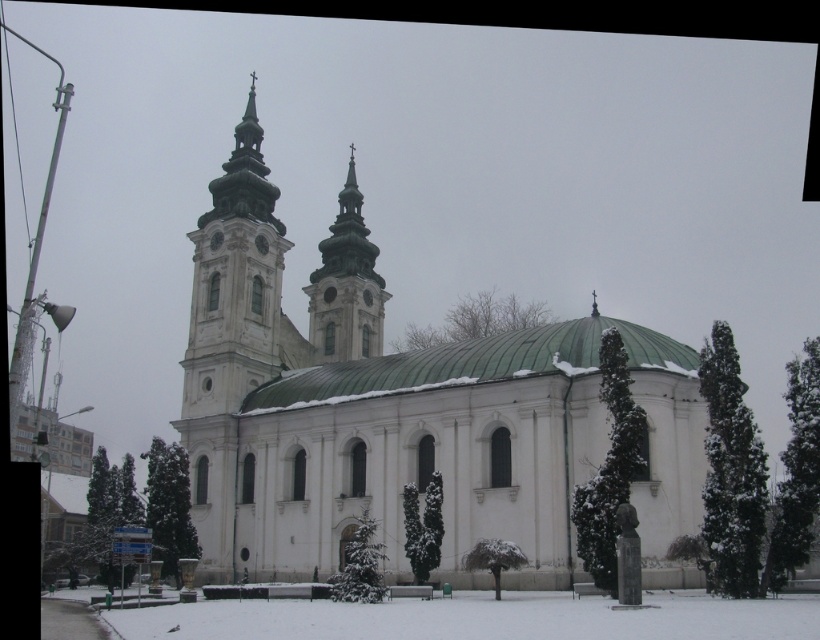
You are a photographer planning to capture the white stone church at center and the white stone tower at upper left in a single shot. Based on their sizes, which one should you focus on to ensure both are clearly visible in the frame?

The white stone church at center is bigger than the white stone tower at upper left, so you should focus on the white stone church at center to ensure both are clearly visible in the frame.

You are standing in front of the white stone church at center and want to take a photo of the smooth white steeple at center. Since the steeple is shorter than the church, will you need to adjust your camera angle upwards or downwards to frame it properly?

The white stone church at center has a greater height compared to the smooth white steeple at center. Therefore, you will need to adjust your camera angle downwards to frame the smooth white steeple at center properly since it is shorter than the church.

You are standing in front of the church and notice two structures on the right side. You want to take a photo where both the white stone tower at upper left and the smooth white steeple at center are visible. Which one should you position closer to the bottom of your camera frame?

The white stone tower at upper left should be positioned closer to the bottom of your camera frame because it is located below the smooth white steeple at center.